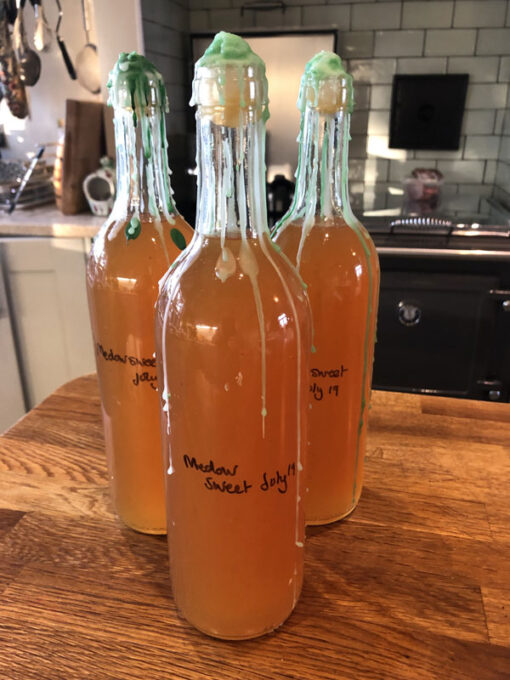
Where is `hanging dishes`? The image size is (510, 680). hanging dishes is located at coordinates (22, 58), (82, 73).